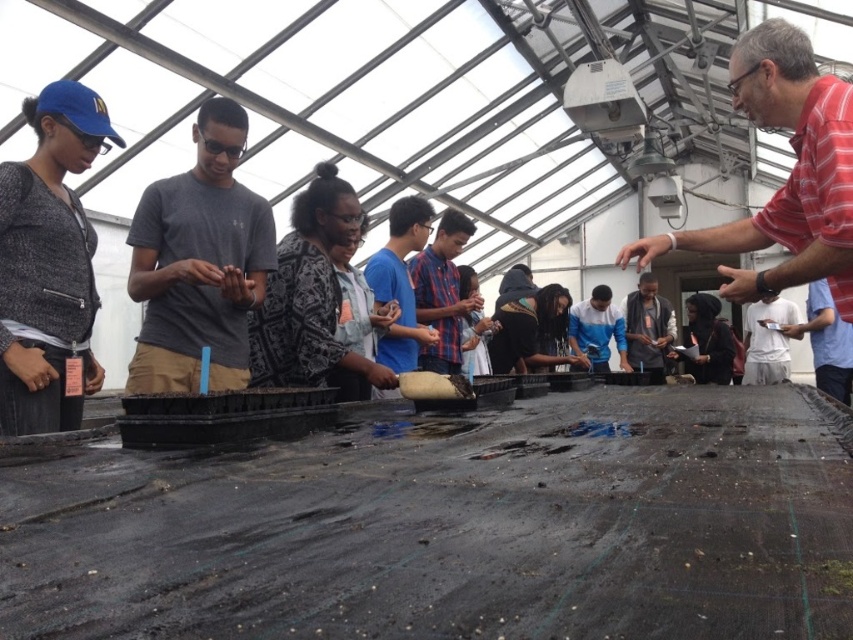
Who is more forward, (26, 326) or (724, 356)?

Point (26, 326) is more forward.

Can you confirm if matte black jacket at left is bigger than dark gray hoodie at center?

No, matte black jacket at left is not bigger than dark gray hoodie at center.

At what (x,y) coordinates should I click in order to perform the action: click on matte black jacket at left. Please return your answer as a coordinate pair (x, y). Image resolution: width=853 pixels, height=640 pixels. Looking at the image, I should click on [x=48, y=262].

Based on the photo, can you confirm if striped cotton shirt at upper right is taller than blue cotton shirt at center?

No.

Does point (796, 140) lie in front of point (390, 269)?

Yes.

Find the location of a particular element. This screenshot has width=853, height=640. striped cotton shirt at upper right is located at coordinates (788, 176).

Which of these two, gray matte t-shirt at center or matte black jacket at left, stands shorter?

With less height is gray matte t-shirt at center.

Is gray matte t-shirt at center shorter than matte black jacket at left?

Yes, gray matte t-shirt at center is shorter than matte black jacket at left.

Is point (242, 387) in front of point (56, 160)?

No.

Where is `gray matte t-shirt at center`? gray matte t-shirt at center is located at coordinates (199, 262).